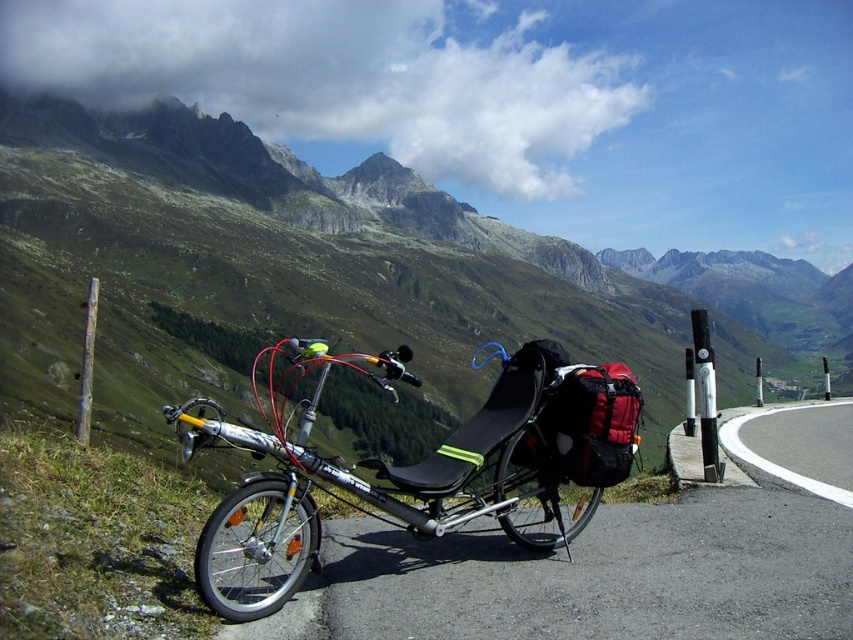
Question: Which of the following is the closest to the observer?

Choices:
 (A) asphalt road at lower right
 (B) red fabric backpack at center
 (C) rugged granite mountain at upper center

Answer: (B)

Question: Which of the following is the closest to the observer?

Choices:
 (A) metallic gray pole at right
 (B) black matte bicycle at center
 (C) wooden post at left

Answer: (B)

Question: Can you confirm if rugged granite mountain at upper center is positioned below asphalt road at lower right?

Choices:
 (A) yes
 (B) no

Answer: (B)

Question: Which point is closer to the camera?

Choices:
 (A) wooden post at left
 (B) metallic gray pole at right
 (C) rugged granite mountain at upper center
 (D) black matte bicycle at center

Answer: (D)

Question: Considering the relative positions of black matte bicycle at center and red fabric backpack at center in the image provided, where is black matte bicycle at center located with respect to red fabric backpack at center?

Choices:
 (A) below
 (B) above

Answer: (A)

Question: Does rugged granite mountain at upper center have a lesser width compared to black matte bicycle at center?

Choices:
 (A) no
 (B) yes

Answer: (A)